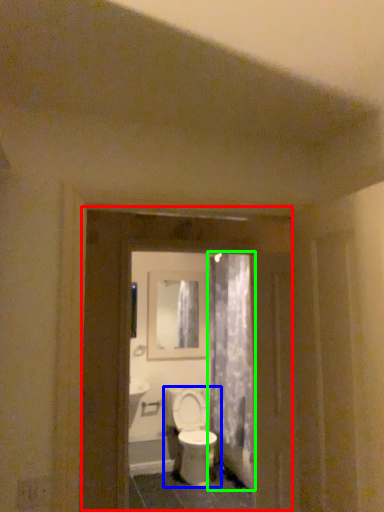
Question: Which is farther away from screen door (highlighted by a red box)? toilet (highlighted by a blue box) or shower curtain (highlighted by a green box)?

Choices:
 (A) toilet
 (B) shower curtain

Answer: (A)